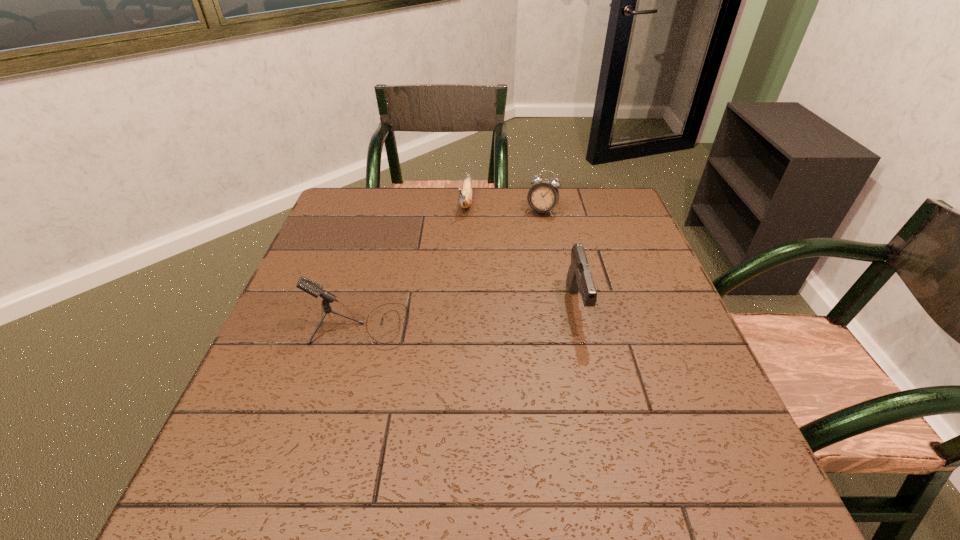
In the image, there is a desktop. Where is `vacant space at the far left corner`? Image resolution: width=960 pixels, height=540 pixels. vacant space at the far left corner is located at coordinates (379, 200).

In the image, there is a desktop. At what (x,y) coordinates should I click in order to perform the action: click on free space at the near left corner. Please return your answer as a coordinate pair (x, y). Looking at the image, I should click on (229, 438).

At what (x,y) coordinates should I click in order to perform the action: click on vacant region at the far right corner. Please return your answer as a coordinate pair (x, y). This screenshot has height=540, width=960. Looking at the image, I should click on (610, 205).

Find the location of a particular element. vacant space that's between the leftmost object and the banana is located at coordinates (413, 264).

Locate an element on the screen. free space between the alarm clock and the leftmost object is located at coordinates (450, 268).

Locate an element on the screen. free space between the leftmost object and the alarm clock is located at coordinates tap(450, 268).

Identify the location of empty space between the pistol and the alarm clock. (560, 259).

Locate an element on the screen. Image resolution: width=960 pixels, height=540 pixels. vacant space that is in between the pistol and the microphone is located at coordinates (468, 316).

Find the location of a particular element. This screenshot has height=540, width=960. vacant region between the alarm clock and the leftmost object is located at coordinates (450, 268).

The height and width of the screenshot is (540, 960). I want to click on free space between the alarm clock and the banana, so click(504, 206).